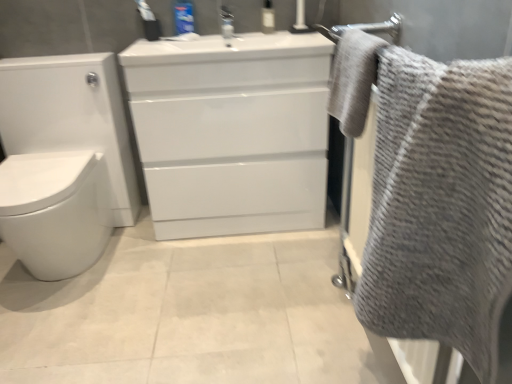
Question: From a real-world perspective, is transparent plastic bottle at upper center, the second toiletry positioned from the left, above or below gray textured towel at upper right, which is the 2th bath towel from bottom to top?

Choices:
 (A) below
 (B) above

Answer: (B)

Question: Considering the positions of transparent plastic bottle at upper center, the second toiletry positioned from the left, and gray textured towel at upper right, acting as the first bath towel starting from the top, in the image, is transparent plastic bottle at upper center, the second toiletry positioned from the left, wider or thinner than gray textured towel at upper right, acting as the first bath towel starting from the top,?

Choices:
 (A) thin
 (B) wide

Answer: (A)

Question: Which object is the farthest from the gray textured towel at right, the 2th bath towel positioned from the top?

Choices:
 (A) white glossy toilet at left
 (B) blue plastic toothpaste tube at upper center, which is counted as the 1th toiletry, starting from the left
 (C) gray textured towel at upper right, acting as the first bath towel starting from the top
 (D) white glossy cabinet at center
 (E) transparent plastic bottle at upper center, the second toiletry positioned from the left

Answer: (A)

Question: Estimate the real-world distances between objects in this image. Which object is closer to the blue plastic toothpaste tube at upper center, placed as the second toiletry when sorted from right to left?

Choices:
 (A) gray textured towel at right, the 2th bath towel positioned from the top
 (B) white glossy cabinet at center
 (C) white glossy toilet at left
 (D) gray textured towel at upper right, which is the 2th bath towel from bottom to top
 (E) transparent plastic bottle at upper center, the second toiletry positioned from the left

Answer: (E)